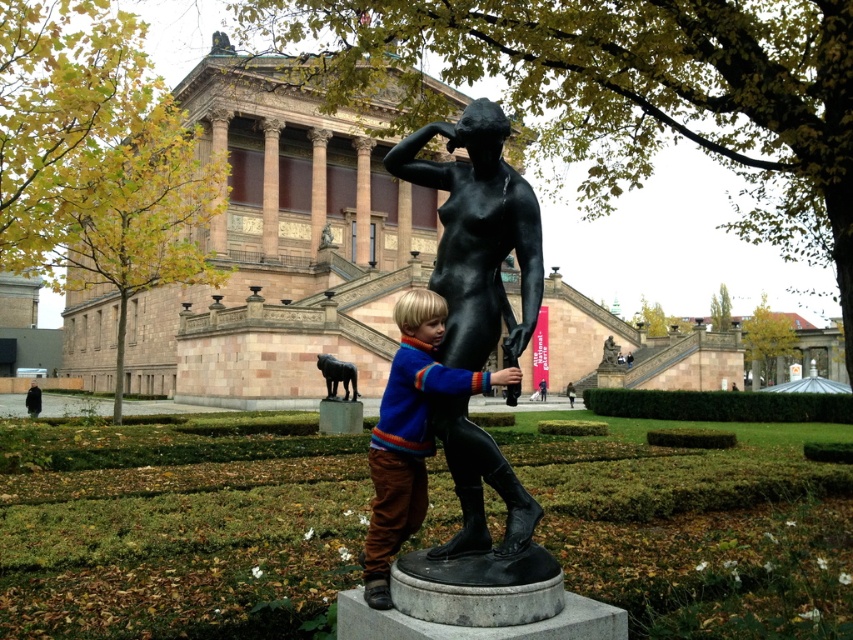
You are standing at the base of the grand neoclassical building and see the point marked at coordinates [178,534]. What object is located at that point?

The point at coordinates [178,534] corresponds to the black marble statue at center.

You are an art student standing in front of the grand neoclassical building. You see the black polished statue at center and the blue wool sweater at center. Which object is closer to you?

The black polished statue at center is closer to you because it is in front of the blue wool sweater at center.

You are standing in front of the grand neoclassical building and see both the black marble statue at center and the black polished statue at center. Which statue is closer to you?

The black marble statue at center is closer to you because it is further to the viewer than the black polished statue at center.